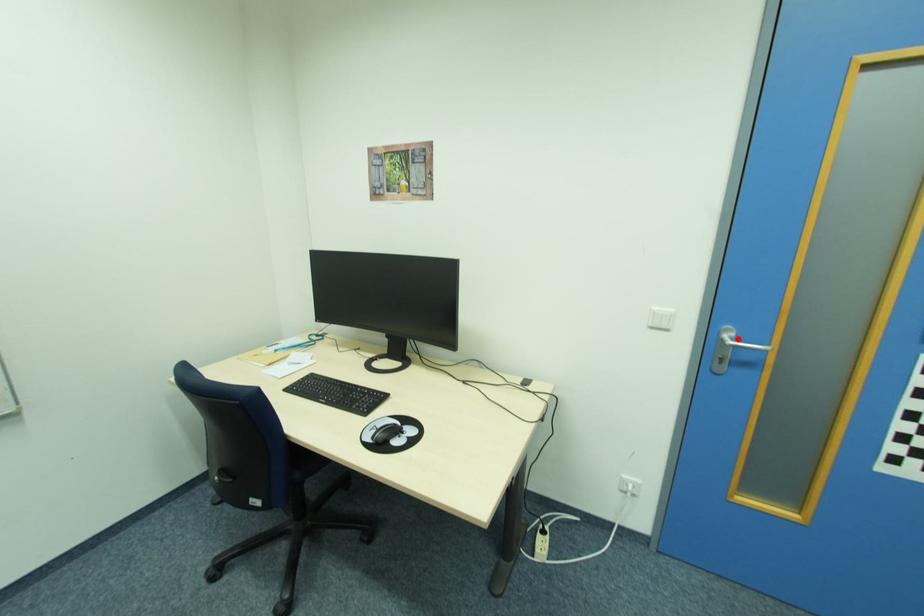
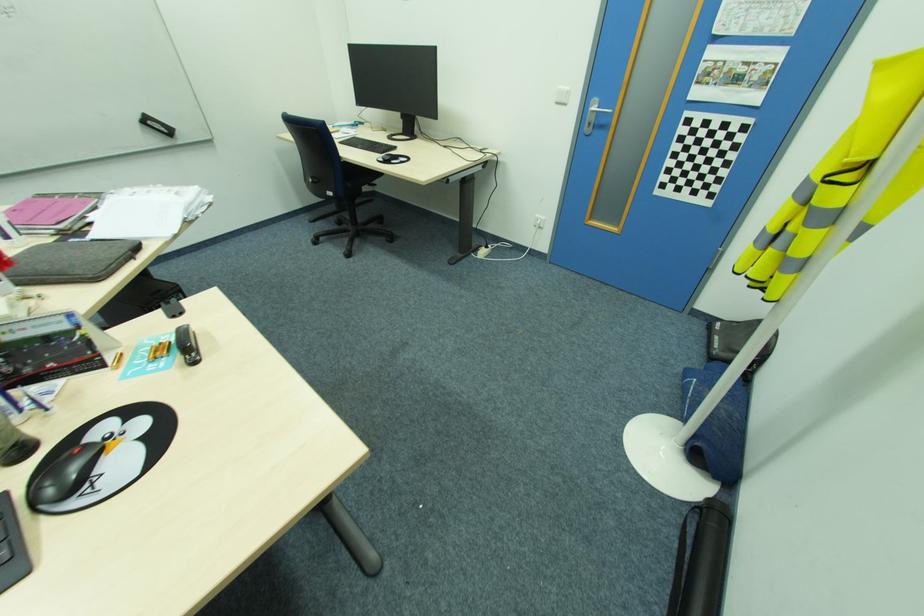
The point at the highlighted location is marked in the first image. Where is the corresponding point in the second image?

(600, 108)